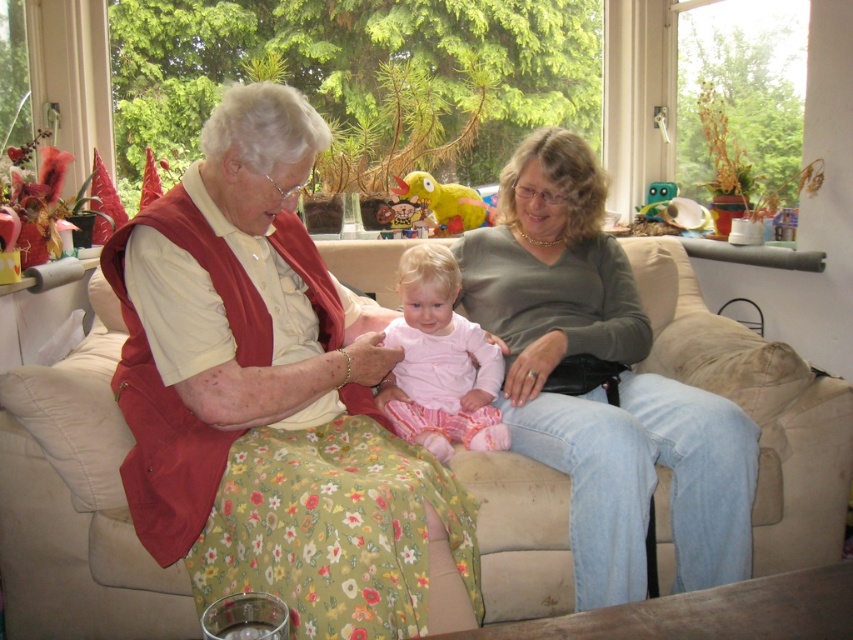
You are a photographer setting up for a family portrait in the living room. You need to ensure that both the floral fabric dress at center and the matte green sweater at center are clearly visible in the photo. Which one should you focus on first to ensure depth of field captures both subjects?

The floral fabric dress at center is closer to the viewer than the matte green sweater at center. To ensure both are in focus, you should focus on the closer object, which is the floral fabric dress at center, as depth of field extends behind the point of focus.